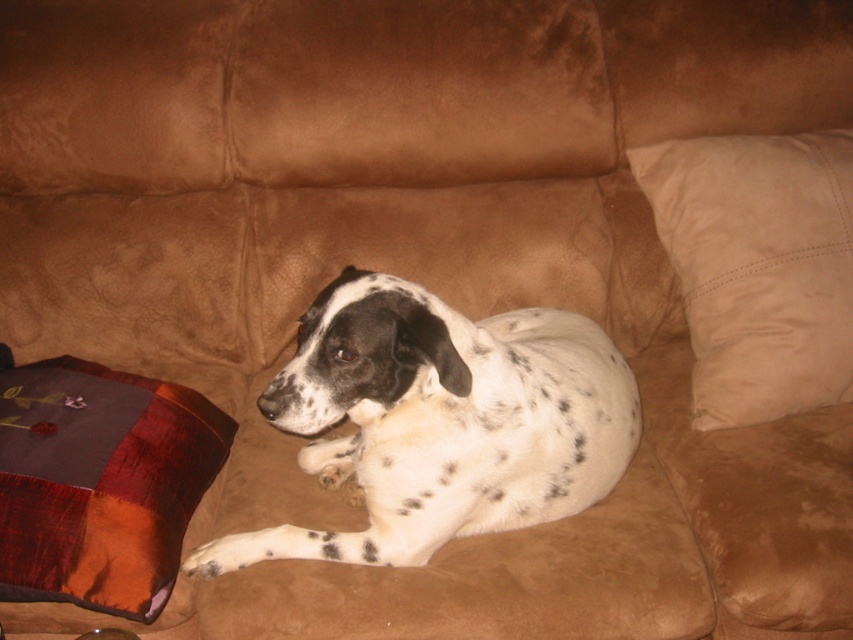
Question: Which of the following is the farthest from the observer?

Choices:
 (A) (747, 289)
 (B) (114, 420)

Answer: (A)

Question: Which object is the farthest from the beige suede pillow at right?

Choices:
 (A) velvet patchwork pillow at lower left
 (B) white-spotted fur at center

Answer: (A)

Question: Which point is farther from the camera taking this photo?

Choices:
 (A) [809, 262]
 (B) [36, 572]

Answer: (A)

Question: Can you confirm if beige suede pillow at right is positioned to the left of velvet patchwork pillow at lower left?

Choices:
 (A) yes
 (B) no

Answer: (B)

Question: Is beige suede pillow at right positioned before velvet patchwork pillow at lower left?

Choices:
 (A) no
 (B) yes

Answer: (A)

Question: Does white-spotted fur at center appear on the left side of beige suede pillow at right?

Choices:
 (A) yes
 (B) no

Answer: (A)